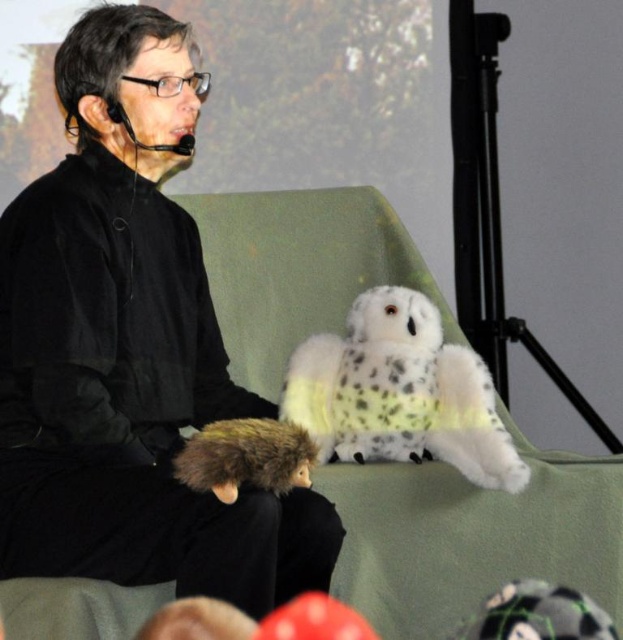
You are a stagehand setting up for a storytelling event. You need to ensure that the black matte plush toy at center is visible to the audience. Since the green fabric armchair at center is in the way, where should you position the plush toy relative to the chair?

The black matte plush toy at center should be placed above the green fabric armchair at center to ensure it is visible to the audience, as it is already positioned above the chair according to the description.